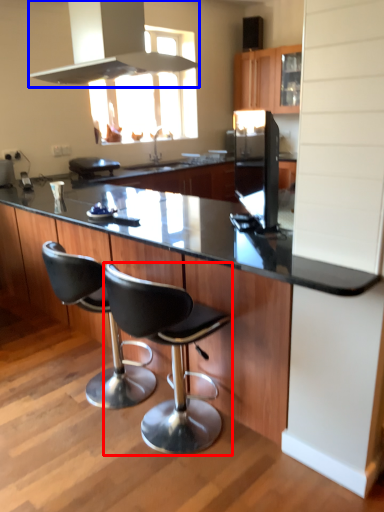
Question: Which object is closer to the camera taking this photo, chair (highlighted by a red box) or exhaust hood (highlighted by a blue box)?

Choices:
 (A) chair
 (B) exhaust hood

Answer: (A)